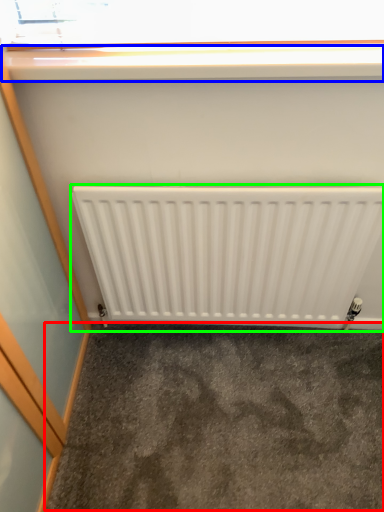
Question: Based on their relative distances, which object is farther from concrete (highlighted by a red box)? Choose from window sill (highlighted by a blue box) and radiator (highlighted by a green box).

Choices:
 (A) window sill
 (B) radiator

Answer: (A)